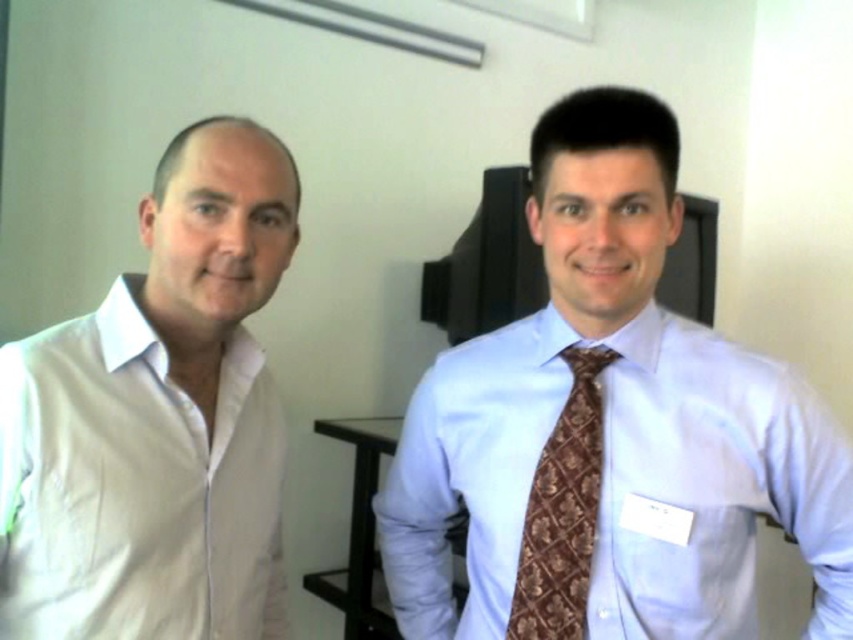
Can you confirm if light blue cotton shirt at right is shorter than brown textured tie at center?

Incorrect, light blue cotton shirt at right's height does not fall short of brown textured tie at center's.

Is light blue cotton shirt at right to the left of brown textured tie at center from the viewer's perspective?

No, light blue cotton shirt at right is not to the left of brown textured tie at center.

Which is in front, point (738, 429) or point (585, 554)?

Point (585, 554) is more forward.

You are a GUI agent. You are given a task and a screenshot of the screen. Output one action in this format:
    pyautogui.click(x=<x>, y=<y>)
    Task: Click on the light blue cotton shirt at right
    
    Given the screenshot: What is the action you would take?
    pyautogui.click(x=619, y=481)

In order to click on white cotton shirt at left in this screenshot , I will do `click(157, 419)`.

Looking at this image, between white cotton shirt at left and brown textured tie at center, which one is positioned lower?

brown textured tie at center

Which is behind, point (158, 481) or point (560, 509)?

The point (560, 509) is more distant.

Where is `white cotton shirt at left`? white cotton shirt at left is located at coordinates [x=157, y=419].

Can you confirm if white cotton shirt at left is positioned below light blue cotton shirt at right?

Actually, white cotton shirt at left is above light blue cotton shirt at right.

Between white cotton shirt at left and light blue cotton shirt at right, which one appears on the right side from the viewer's perspective?

From the viewer's perspective, light blue cotton shirt at right appears more on the right side.

Which is behind, point (160, 342) or point (518, 392)?

Positioned behind is point (518, 392).

The width and height of the screenshot is (853, 640). I want to click on white cotton shirt at left, so click(x=157, y=419).